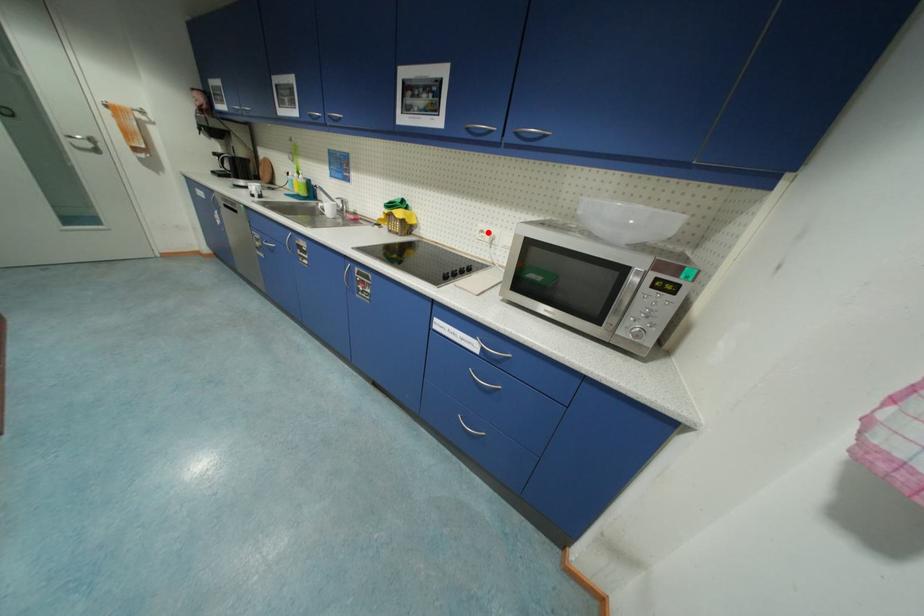
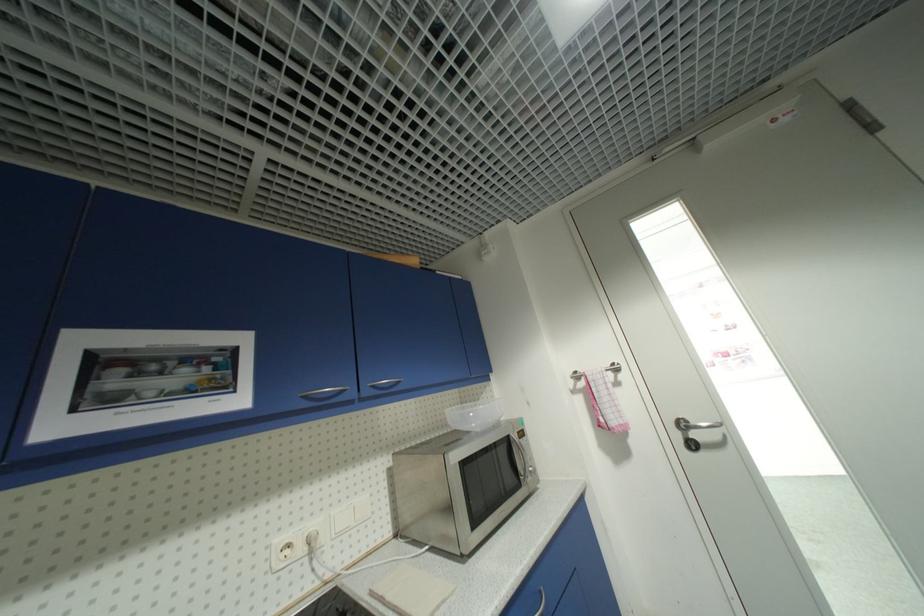
In the second image, find the point that corresponds to the highlighted location in the first image.

(294, 546)